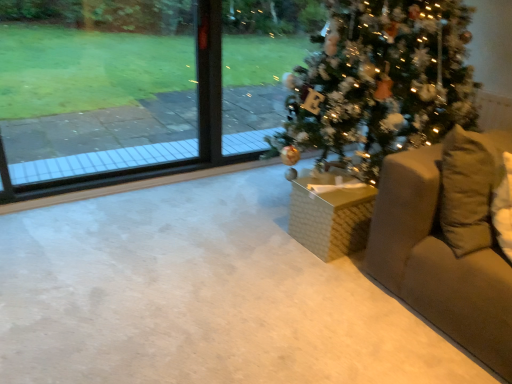
Question: From the image's perspective, relative to beige fabric couch at right, the 2th furniture positioned from the left, is shiny green christmas tree at center above or below?

Choices:
 (A) below
 (B) above

Answer: (B)

Question: Is shiny green christmas tree at center to the left or to the right of beige fabric couch at right, the first furniture viewed from the right, in the image?

Choices:
 (A) left
 (B) right

Answer: (A)

Question: Considering the real-world distances, which object is closest to the transparent glass window at upper left?

Choices:
 (A) shiny green christmas tree at center
 (B) beige fabric couch at right, the first furniture viewed from the right
 (C) white woven basket at center, the 2th furniture from the right

Answer: (A)

Question: Which object is positioned closest to the white woven basket at center, the 2th furniture from the right?

Choices:
 (A) transparent glass window at upper left
 (B) shiny green christmas tree at center
 (C) beige fabric couch at right, the first furniture viewed from the right

Answer: (C)